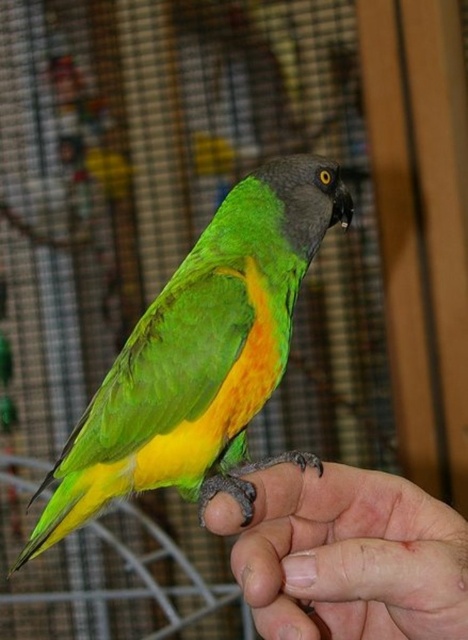
Question: Among these points, which one is farthest from the camera?

Choices:
 (A) (115, 371)
 (B) (337, 566)

Answer: (A)

Question: Does green matte parrot at center have a smaller size compared to smooth skin hand at lower right?

Choices:
 (A) no
 (B) yes

Answer: (A)

Question: Is green matte parrot at center in front of smooth skin hand at lower right?

Choices:
 (A) no
 (B) yes

Answer: (A)

Question: Does green matte parrot at center have a larger size compared to smooth skin hand at lower right?

Choices:
 (A) no
 (B) yes

Answer: (B)

Question: Which of the following is the closest to the observer?

Choices:
 (A) (299, 621)
 (B) (218, 472)

Answer: (A)

Question: Which of the following is the farthest from the observer?

Choices:
 (A) (389, 566)
 (B) (293, 211)

Answer: (B)